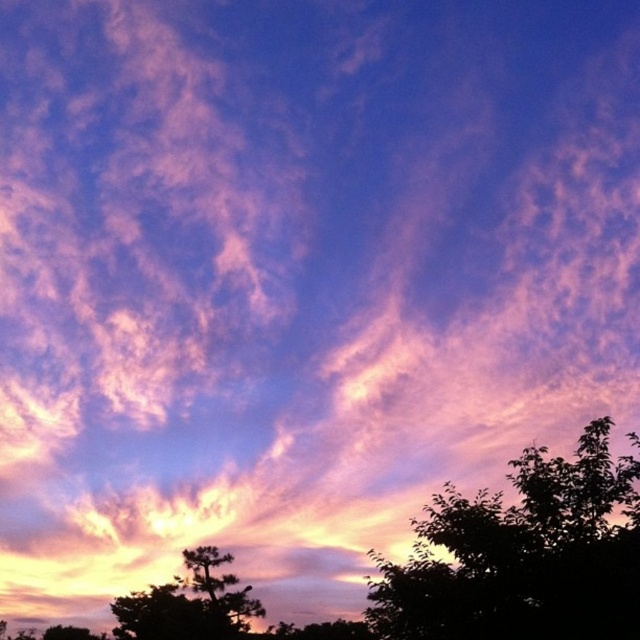
Question: Which point appears farthest from the camera in this image?

Choices:
 (A) (246, 616)
 (B) (554, 636)

Answer: (A)

Question: Can you confirm if silhouette leafy tree at lower right is thinner than silhouette pine tree at lower left?

Choices:
 (A) yes
 (B) no

Answer: (B)

Question: Is silhouette leafy tree at lower right positioned at the back of silhouette pine tree at lower left?

Choices:
 (A) yes
 (B) no

Answer: (B)

Question: Which object appears closest to the camera in this image?

Choices:
 (A) silhouette pine tree at lower left
 (B) silhouette leafy tree at lower right

Answer: (B)

Question: Observing the image, what is the correct spatial positioning of silhouette leafy tree at lower right in reference to silhouette pine tree at lower left?

Choices:
 (A) left
 (B) right

Answer: (B)